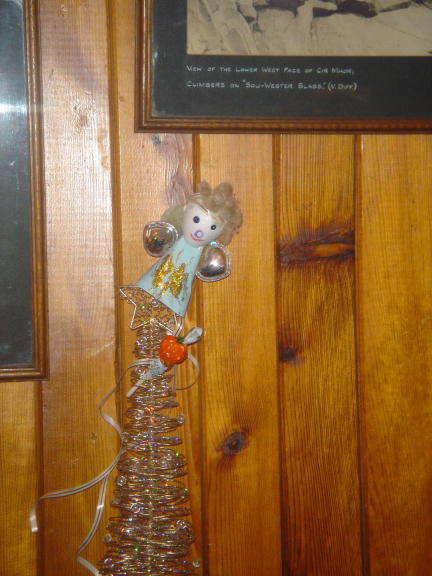
Identify the location of wooden panel wall. (235, 348).